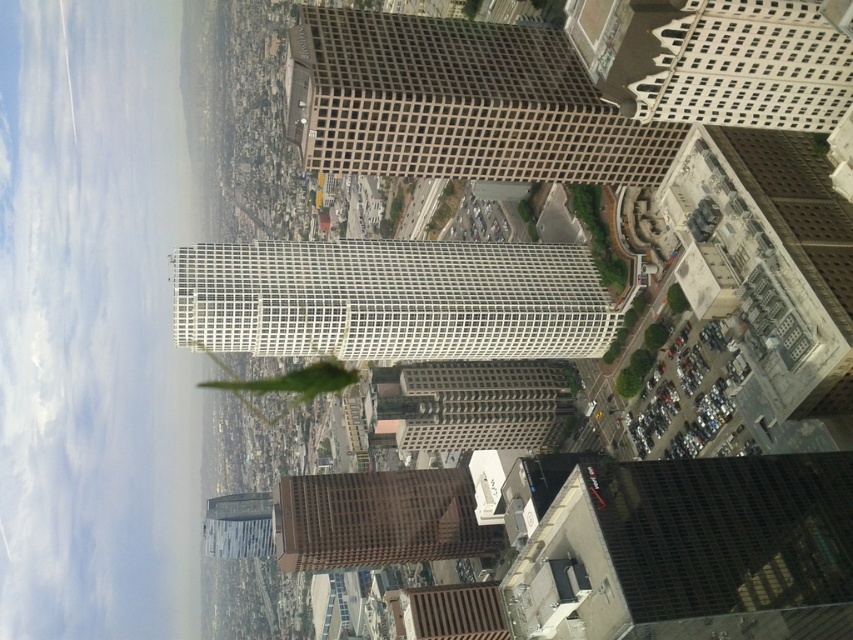
Question: Considering the real-world distances, which object is closest to the green matte tower at center?

Choices:
 (A) white textured building at upper right
 (B) white glassy skyscraper at center

Answer: (A)

Question: Is the position of white glassy skyscraper at center more distant than that of white textured building at upper right?

Choices:
 (A) yes
 (B) no

Answer: (A)

Question: Which of these objects is positioned closest to the green matte tower at center?

Choices:
 (A) white glassy skyscraper at center
 (B) white textured building at upper right

Answer: (B)

Question: Is green matte tower at center further to camera compared to white glassy skyscraper at center?

Choices:
 (A) no
 (B) yes

Answer: (A)

Question: Which of these objects is positioned closest to the green matte tower at center?

Choices:
 (A) white glassy skyscraper at center
 (B) white textured building at upper right

Answer: (B)

Question: Is white glassy skyscraper at center to the left of white textured building at upper right from the viewer's perspective?

Choices:
 (A) no
 (B) yes

Answer: (B)